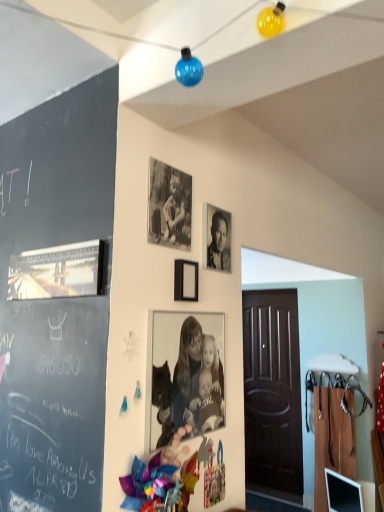
Question: From their relative heights in the image, would you say black and white photograph of people at center, which is the 1th person in bottom-to-top order, is taller or shorter than black matte photo frame at center, the second picture frame positioned from the right?

Choices:
 (A) short
 (B) tall

Answer: (B)

Question: Looking at their shapes, would you say black and white photograph of people at center, which ranks as the 2th person in top-to-bottom order, is wider or thinner than black matte photo frame at center, the second picture frame positioned from the right?

Choices:
 (A) wide
 (B) thin

Answer: (B)

Question: Which object is positioned farthest from the black and white photograph at upper center, positioned as the first person in top-to-bottom order?

Choices:
 (A) black and white photograph of people at center, which is the 1th person in bottom-to-top order
 (B) matte black picture frame at upper center, which is the first picture frame from right to left
 (C) black matte photo frame at center, which is counted as the 2th picture frame, starting from the left
 (D) metallic silver picture frame at left, marked as the 1th picture frame in a left-to-right arrangement

Answer: (D)

Question: Estimate the real-world distances between objects in this image. Which object is farther from the black and white photograph at upper center, positioned as the first person in top-to-bottom order?

Choices:
 (A) black and white photograph of people at center, which ranks as the 2th person in top-to-bottom order
 (B) black matte photo frame at center, the second picture frame positioned from the right
 (C) matte black picture frame at upper center, which is the first picture frame from right to left
 (D) metallic silver picture frame at left, marked as the 1th picture frame in a left-to-right arrangement

Answer: (D)